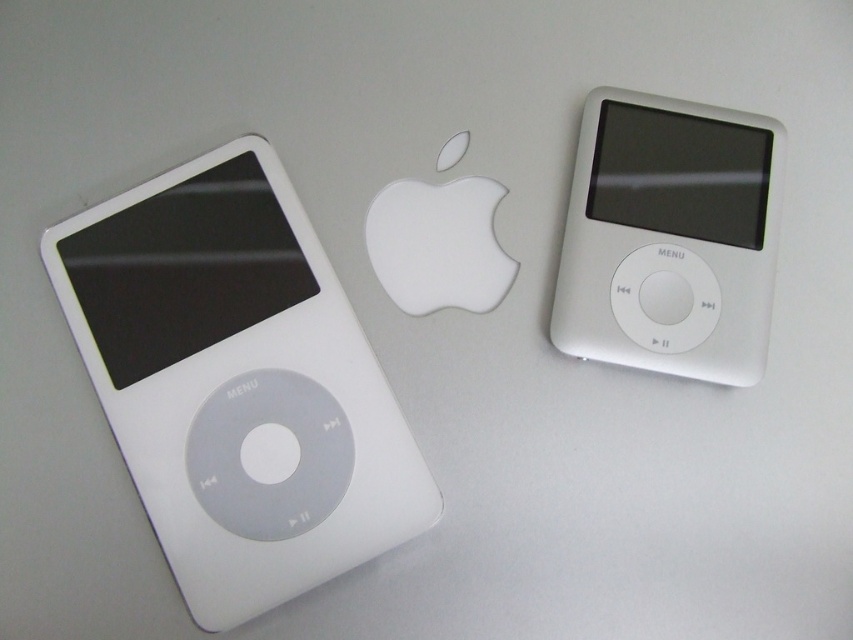
Question: Which point appears closest to the camera in this image?

Choices:
 (A) (242, 499)
 (B) (698, 339)

Answer: (A)

Question: Can you confirm if white matte ipod at left is wider than white matte ipod at right?

Choices:
 (A) no
 (B) yes

Answer: (B)

Question: Among these points, which one is farthest from the camera?

Choices:
 (A) (757, 193)
 (B) (267, 161)

Answer: (B)

Question: Does white matte ipod at left have a smaller size compared to white matte ipod at right?

Choices:
 (A) no
 (B) yes

Answer: (A)

Question: Does white matte ipod at left appear under white matte ipod at right?

Choices:
 (A) yes
 (B) no

Answer: (A)